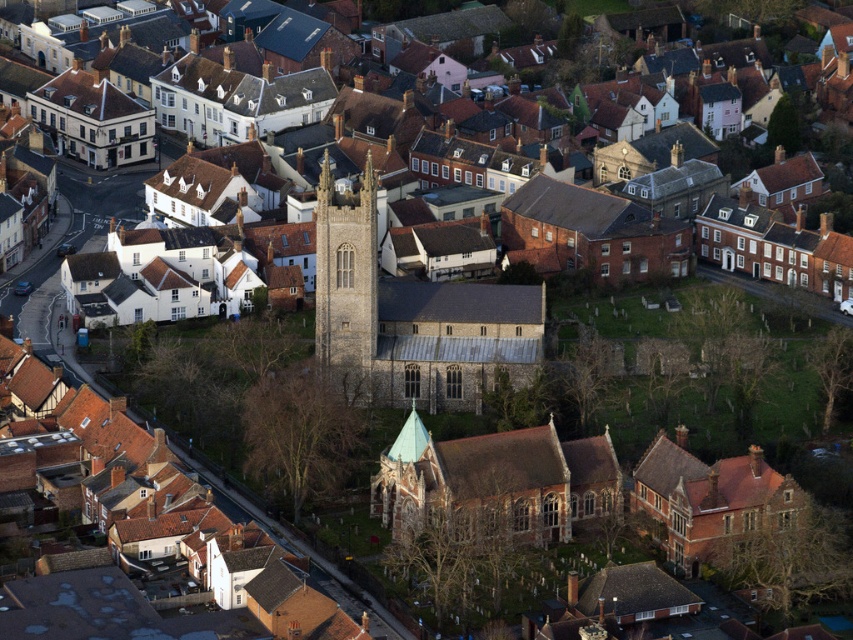
Image resolution: width=853 pixels, height=640 pixels. What do you see at coordinates (412, 317) in the screenshot? I see `stone church at center` at bounding box center [412, 317].

Describe the element at coordinates (412, 317) in the screenshot. I see `stone church at center` at that location.

The image size is (853, 640). Find the location of `stone church at center`. stone church at center is located at coordinates (412, 317).

Is brown brick church at lower center taller than dark gray stone tower at center?

No, brown brick church at lower center is not taller than dark gray stone tower at center.

The width and height of the screenshot is (853, 640). In order to click on brown brick church at lower center in this screenshot , I will do `click(578, 488)`.

You are a GUI agent. You are given a task and a screenshot of the screen. Output one action in this format:
    pyautogui.click(x=<x>, y=<y>)
    Task: Click on the brown brick church at lower center
    The width and height of the screenshot is (853, 640).
    Given the screenshot: What is the action you would take?
    pyautogui.click(x=578, y=488)

Consider the image. Between brown brick church at lower center and stone church at center, which one is positioned lower?

brown brick church at lower center is below.

Who is more forward, (473,452) or (436,365)?

Point (473,452)

Between point (502, 460) and point (341, 376), which one is positioned behind?

Point (341, 376)

Locate an element on the screen. The height and width of the screenshot is (640, 853). brown brick church at lower center is located at coordinates (578, 488).